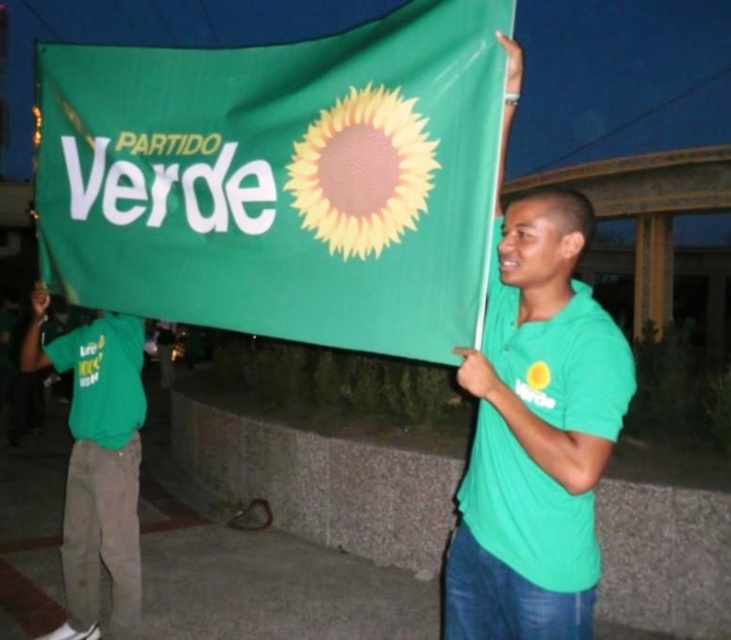
Question: Which point appears closest to the camera in this image?

Choices:
 (A) (530, 596)
 (B) (79, 147)

Answer: (A)

Question: Is green fabric flag at center smaller than green cotton shirt at left?

Choices:
 (A) yes
 (B) no

Answer: (B)

Question: Can you confirm if green matte shirt at center is thinner than green cotton shirt at left?

Choices:
 (A) no
 (B) yes

Answer: (B)

Question: From the image, what is the correct spatial relationship of green matte shirt at center in relation to green cotton shirt at left?

Choices:
 (A) below
 (B) above

Answer: (B)

Question: Considering the real-world distances, which object is farthest from the green fabric flag at center?

Choices:
 (A) green cotton shirt at left
 (B) green matte shirt at center

Answer: (A)

Question: Estimate the real-world distances between objects in this image. Which object is farther from the green fabric flag at center?

Choices:
 (A) green cotton shirt at left
 (B) green matte shirt at center

Answer: (A)